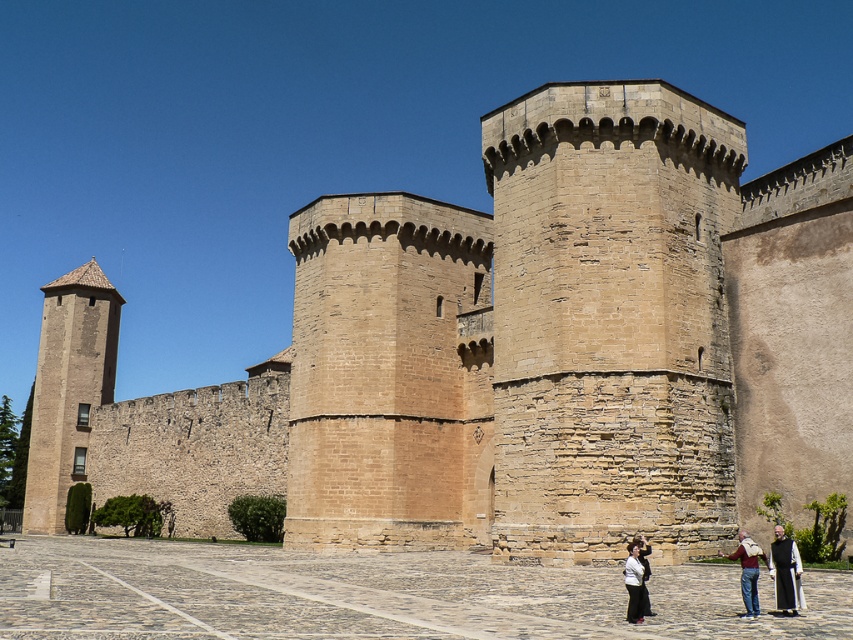
You are standing in front of the historic stone structure and see both the dark brown robe at lower right and the denim jeans at lower right. Which object is closer to you?

The dark brown robe at lower right is closer to you because the denim jeans at lower right is behind it.

You are standing in the courtyard of the historic stone structure and see the brown stone tower at left and the dark brown robe at lower right. Which object is located to the east side of the other?

The brown stone tower at left is positioned on the left side of dark brown robe at lower right, so the brown stone tower at left is to the east side of the dark brown robe at lower right.

You are standing at point (68, 388) in the image. What object is located at this point?

The brown stone tower at left is located at point (68, 388).